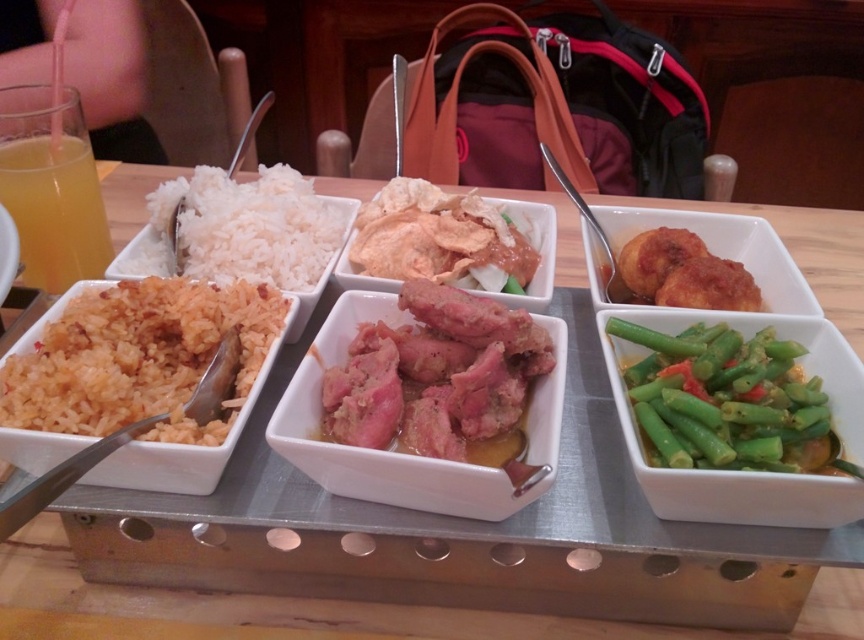
You are a food critic evaluating the presentation of this meal. Considering the height of the orange rice at left and the shiny brown meat at center, which dish appears taller when viewed from above?

The shiny brown meat at center is taller than the orange rice at left, so the shiny brown meat at center appears taller when viewed from above.

You are a food delivery person who needs to place a hot pad between the orange rice at left and the shiny brown meat at center on the tray. Which one should you place the hot pad under to prevent burns?

The orange rice at left is in front of the shiny brown meat at center, so placing the hot pad under the orange rice at left would be more effective in preventing burns since it is closer to the tray surface.